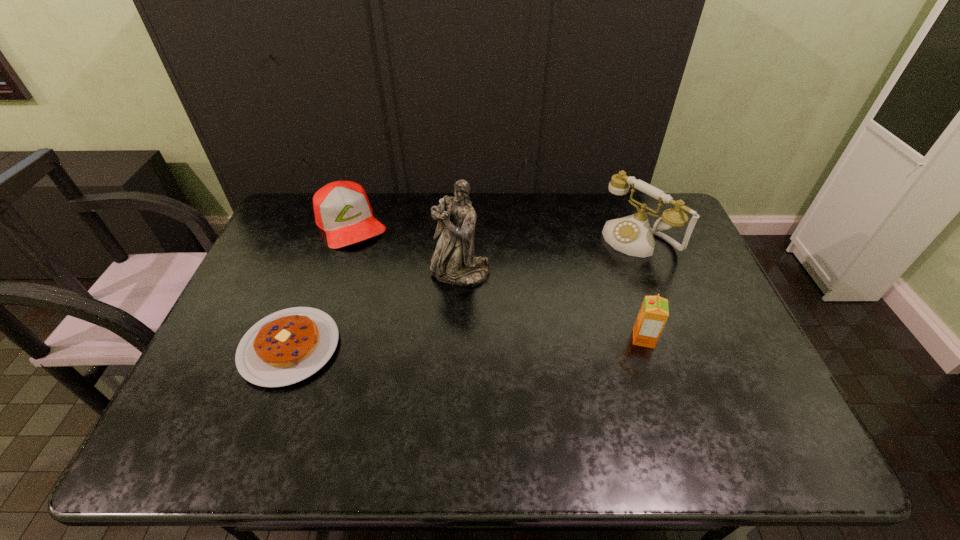
Locate an element on the screen. pancake at the left edge is located at coordinates (285, 347).

The height and width of the screenshot is (540, 960). What are the coordinates of `baseball cap that is at the left edge` in the screenshot? It's located at click(342, 209).

The width and height of the screenshot is (960, 540). I want to click on object situated at the right edge, so click(632, 235).

At what (x,y) coordinates should I click in order to perform the action: click on object that is at the far left corner. Please return your answer as a coordinate pair (x, y). Looking at the image, I should click on (342, 209).

The image size is (960, 540). What are the coordinates of `object at the near left corner` in the screenshot? It's located at coord(285,347).

You are a GUI agent. You are given a task and a screenshot of the screen. Output one action in this format:
    pyautogui.click(x=<x>, y=<y>)
    Task: Click on the object that is at the far right corner
    Image resolution: width=960 pixels, height=540 pixels.
    Given the screenshot: What is the action you would take?
    pyautogui.click(x=632, y=235)

Where is `vacant space at the far edge of the desktop`? The height and width of the screenshot is (540, 960). vacant space at the far edge of the desktop is located at coordinates (528, 213).

Where is `blank space at the near edge of the desktop`? The height and width of the screenshot is (540, 960). blank space at the near edge of the desktop is located at coordinates (349, 381).

Identify the location of vacant region at the left edge. The width and height of the screenshot is (960, 540). (253, 291).

In the image, there is a desktop. At what (x,y) coordinates should I click in order to perform the action: click on vacant space at the right edge. Please return your answer as a coordinate pair (x, y). Looking at the image, I should click on (x=693, y=257).